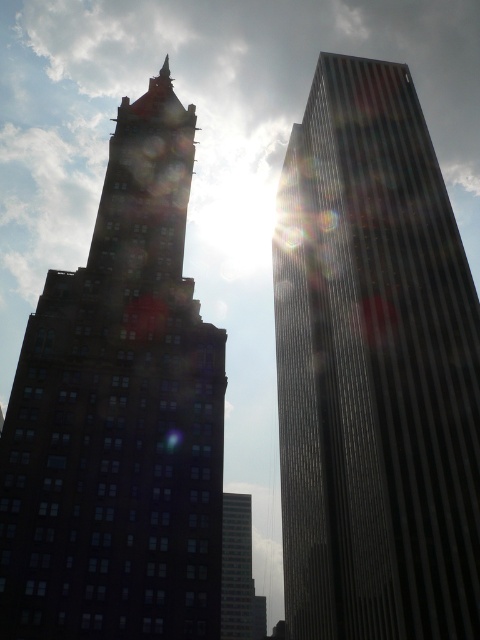
You are a photographer planning to capture the skyline. You have a camera with a 20mm lens that can capture a horizontal field of view of 60 degrees. If the reflective glass skyscraper at right is wider than the smooth glass skyscraper at center, which one would require a wider angle lens to fit entirely in the frame?

The reflective glass skyscraper at right is wider than the smooth glass skyscraper at center, so it would require a wider angle lens to fit entirely in the frame.